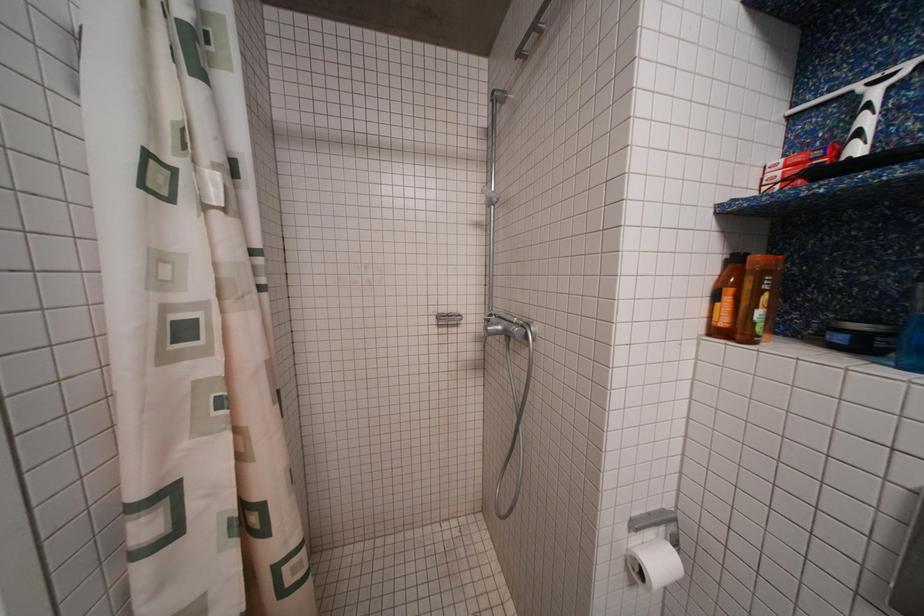
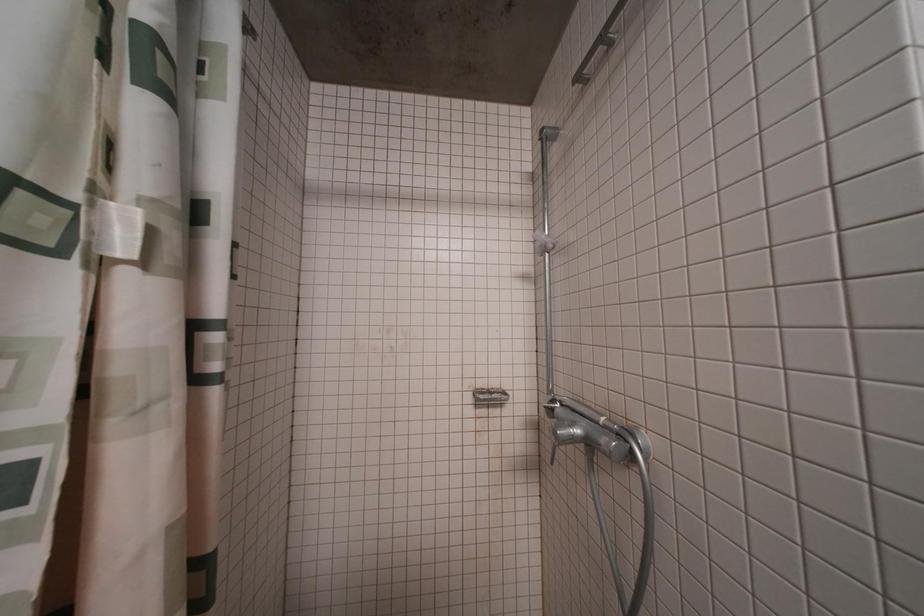
Question: The images are taken continuously from a first-person perspective. In which direction is your viewpoint rotating?

Choices:
 (A) Left
 (B) Right
 (C) Up
 (D) Down

Answer: (C)